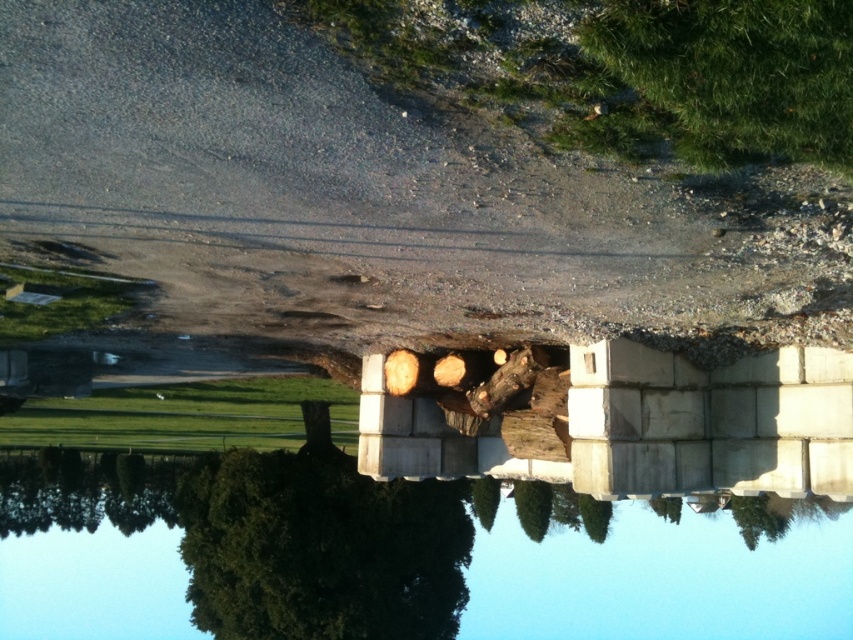
Consider the image. Does green fuzzy tree at upper center have a greater height compared to wooden log at center?

No, green fuzzy tree at upper center is not taller than wooden log at center.

Is green fuzzy tree at upper center behind wooden log at center?

No, green fuzzy tree at upper center is in front of wooden log at center.

Who is more distant from viewer, (792,54) or (476,394)?

Positioned behind is point (476,394).

Image resolution: width=853 pixels, height=640 pixels. I want to click on green fuzzy tree at upper center, so click(735, 72).

Does transparent concrete water at center have a greater width compared to green leafy tree at center?

Yes.

Between transparent concrete water at center and green leafy tree at center, which one has more height?

With more height is transparent concrete water at center.

Who is more distant from viewer, (73,595) or (448,605)?

Positioned behind is point (73,595).

I want to click on transparent concrete water at center, so click(402, 557).

Between transparent concrete water at center and wooden log at center, which one is positioned lower?

Positioned lower is transparent concrete water at center.

Can you confirm if transparent concrete water at center is positioned to the left of wooden log at center?

Incorrect, transparent concrete water at center is not on the left side of wooden log at center.

The image size is (853, 640). What do you see at coordinates (402, 557) in the screenshot? I see `transparent concrete water at center` at bounding box center [402, 557].

At what (x,y) coordinates should I click in order to perform the action: click on transparent concrete water at center. Please return your answer as a coordinate pair (x, y). The width and height of the screenshot is (853, 640). Looking at the image, I should click on (402, 557).